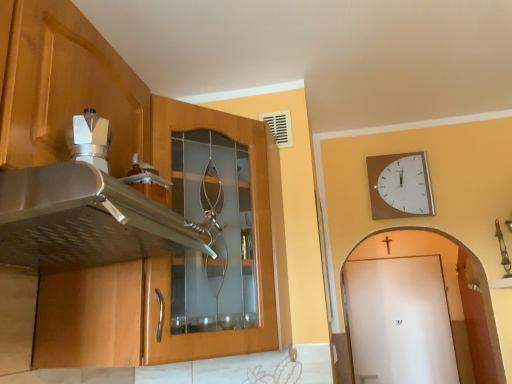
This screenshot has width=512, height=384. I want to click on empty space that is ontop of white matte door at right (from a real-world perspective), so click(395, 259).